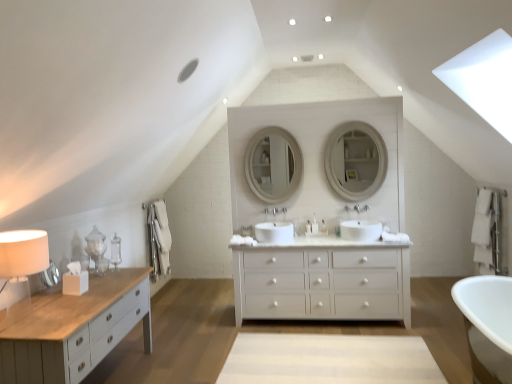
This screenshot has height=384, width=512. Find the location of `white fabric lampshade at left`. white fabric lampshade at left is located at coordinates (21, 265).

This screenshot has height=384, width=512. Identify the location of white glossy faucet at center, the second faucet positioned from the right. click(x=275, y=211).

What do you see at coordinates (275, 211) in the screenshot?
I see `white glossy faucet at center, the first faucet viewed from the left` at bounding box center [275, 211].

Identify the location of white matte chest of drawers at center. The width and height of the screenshot is (512, 384). (322, 283).

The width and height of the screenshot is (512, 384). What are the coordinates of `white glossy sink at center, the second sink in the right-to-left sequence` in the screenshot? It's located at (274, 231).

Can you confirm if white glossy sink at center, the second sink in the right-to-left sequence, is positioned to the right of white glossy faucet at center, the second faucet positioned from the right?

No.

In the scene shown: Who is taller, white glossy sink at center, the second sink in the right-to-left sequence, or white glossy faucet at center, the second faucet positioned from the right?

Answer: white glossy sink at center, the second sink in the right-to-left sequence, is taller.

From the image's perspective, is white glossy sink at center, the second sink in the right-to-left sequence, below white glossy faucet at center, the first faucet viewed from the left?

Yes.

In the scene shown: Would you say white glossy sink at center, the second sink in the right-to-left sequence, is outside white glossy faucet at center, the second faucet positioned from the right?

Indeed, white glossy sink at center, the second sink in the right-to-left sequence, is completely outside white glossy faucet at center, the second faucet positioned from the right.

Between white glossy sink at center, the second sink in the right-to-left sequence, and white fabric lampshade at left, which one has less height?

white glossy sink at center, the second sink in the right-to-left sequence.

Is white fabric lampshade at left surrounded by white glossy sink at center, the second sink in the right-to-left sequence?

No, white glossy sink at center, the second sink in the right-to-left sequence, does not contain white fabric lampshade at left.

How distant is white glossy sink at center, the second sink in the right-to-left sequence, from white fabric lampshade at left?

A distance of 7.99 feet exists between white glossy sink at center, the second sink in the right-to-left sequence, and white fabric lampshade at left.

Which is behind, point (290, 230) or point (10, 269)?

The point (290, 230) is farther from the camera.

In the scene shown: Is white glossy sink at center, which is the second sink in left-to-right order, facing towards white ceramic faucet at center, marked as the first faucet in a right-to-left arrangement?

No, white glossy sink at center, which is the second sink in left-to-right order, is not aimed at white ceramic faucet at center, marked as the first faucet in a right-to-left arrangement.

Are white glossy sink at center, the first sink from the right, and white ceramic faucet at center, which is counted as the 2th faucet, starting from the left, located far from each other?

No, there isn't a large distance between white glossy sink at center, the first sink from the right, and white ceramic faucet at center, which is counted as the 2th faucet, starting from the left.

Who is bigger, white glossy sink at center, the first sink from the right, or white ceramic faucet at center, marked as the first faucet in a right-to-left arrangement?

Bigger between the two is white glossy sink at center, the first sink from the right.

Based on the photo, considering the relative sizes of white glossy sink at center, which is the second sink in left-to-right order, and white ceramic faucet at center, marked as the first faucet in a right-to-left arrangement, in the image provided, is white glossy sink at center, which is the second sink in left-to-right order, taller than white ceramic faucet at center, marked as the first faucet in a right-to-left arrangement,?

Correct, white glossy sink at center, which is the second sink in left-to-right order, is much taller as white ceramic faucet at center, marked as the first faucet in a right-to-left arrangement.

Is white ceramic faucet at center, marked as the first faucet in a right-to-left arrangement, wider than matte white mirror at center, the 2th mirror in the left-to-right sequence?

Yes.

Does white ceramic faucet at center, which is counted as the 2th faucet, starting from the left, have a lesser height compared to matte white mirror at center, placed as the first mirror when sorted from right to left?

Yes, white ceramic faucet at center, which is counted as the 2th faucet, starting from the left, is shorter than matte white mirror at center, placed as the first mirror when sorted from right to left.

Considering the relative positions of white ceramic faucet at center, which is counted as the 2th faucet, starting from the left, and matte white mirror at center, placed as the first mirror when sorted from right to left, in the image provided, is white ceramic faucet at center, which is counted as the 2th faucet, starting from the left, to the left of matte white mirror at center, placed as the first mirror when sorted from right to left, from the viewer's perspective?

Indeed, white ceramic faucet at center, which is counted as the 2th faucet, starting from the left, is positioned on the left side of matte white mirror at center, placed as the first mirror when sorted from right to left.

Measure the distance between white ceramic faucet at center, marked as the first faucet in a right-to-left arrangement, and matte white mirror at center, placed as the first mirror when sorted from right to left.

37.19 inches.

Visually, is white glossy mirror at center, acting as the second mirror starting from the right, positioned to the left or to the right of white ceramic faucet at center, marked as the first faucet in a right-to-left arrangement?

Clearly, white glossy mirror at center, acting as the second mirror starting from the right, is on the left of white ceramic faucet at center, marked as the first faucet in a right-to-left arrangement, in the image.

From a real-world perspective, is white glossy mirror at center, acting as the second mirror starting from the right, physically located above or below white ceramic faucet at center, marked as the first faucet in a right-to-left arrangement?

white glossy mirror at center, acting as the second mirror starting from the right, is situated higher than white ceramic faucet at center, marked as the first faucet in a right-to-left arrangement, in the real world.

Is white glossy mirror at center, acting as the second mirror starting from the right, turned away from white ceramic faucet at center, which is counted as the 2th faucet, starting from the left?

No, white ceramic faucet at center, which is counted as the 2th faucet, starting from the left, is not at the back of white glossy mirror at center, acting as the second mirror starting from the right.

Which of these two, white glossy mirror at center, acting as the second mirror starting from the right, or white ceramic faucet at center, marked as the first faucet in a right-to-left arrangement, is bigger?

Bigger between the two is white glossy mirror at center, acting as the second mirror starting from the right.

What's the angular difference between white glossy faucet at center, the second faucet positioned from the right, and white glossy mirror at center, the first mirror in the left-to-right sequence,'s facing directions?

white glossy faucet at center, the second faucet positioned from the right, and white glossy mirror at center, the first mirror in the left-to-right sequence, are facing 0.309 degrees away from each other.

In terms of width, does white glossy faucet at center, the first faucet viewed from the left, look wider or thinner when compared to white glossy mirror at center, acting as the second mirror starting from the right?

In the image, white glossy faucet at center, the first faucet viewed from the left, appears to be wider than white glossy mirror at center, acting as the second mirror starting from the right.

Which object is positioned more to the left, white glossy faucet at center, the first faucet viewed from the left, or white glossy mirror at center, the first mirror in the left-to-right sequence?

Positioned to the left is white glossy mirror at center, the first mirror in the left-to-right sequence.

From the image's perspective, relative to white glossy mirror at center, the first mirror in the left-to-right sequence, is white glossy faucet at center, the second faucet positioned from the right, above or below?

white glossy faucet at center, the second faucet positioned from the right, is below white glossy mirror at center, the first mirror in the left-to-right sequence.

From a real-world perspective, is white glossy soap dispenser at center, marked as the 1th toiletry in a left-to-right arrangement, on top of white glossy sink at center, the second sink in the right-to-left sequence?

Indeed, from a real-world perspective, white glossy soap dispenser at center, marked as the 1th toiletry in a left-to-right arrangement, stands above white glossy sink at center, the second sink in the right-to-left sequence.

Is white glossy soap dispenser at center, which is counted as the 3th toiletry, starting from the right, aimed at white glossy sink at center, the second sink in the right-to-left sequence?

No, white glossy soap dispenser at center, which is counted as the 3th toiletry, starting from the right, does not turn towards white glossy sink at center, the second sink in the right-to-left sequence.

Considering the sizes of objects white glossy soap dispenser at center, marked as the 1th toiletry in a left-to-right arrangement, and white glossy sink at center, the second sink in the right-to-left sequence, in the image provided, who is shorter, white glossy soap dispenser at center, marked as the 1th toiletry in a left-to-right arrangement, or white glossy sink at center, the second sink in the right-to-left sequence,?

Standing shorter between the two is white glossy sink at center, the second sink in the right-to-left sequence.

Starting from the white glossy sink at center, the 1th sink in the left-to-right sequence, which faucet is the 1st one to the right? Please provide its 2D coordinates.

[(275, 211)]

Which sink is the 2nd one when counting from the back of the white fabric lampshade at left? Please provide its 2D coordinates.

[(274, 231)]

Which object lies nearer to the anchor point white glossy soap dispenser at center, which is counted as the 3th toiletry, starting from the right, white glossy mirror at center, acting as the second mirror starting from the right, or white glossy sink at center, the second sink in the right-to-left sequence?

Among the two, white glossy sink at center, the second sink in the right-to-left sequence, is located nearer to white glossy soap dispenser at center, which is counted as the 3th toiletry, starting from the right.

Which object lies nearer to the anchor point white glossy sink at center, which is the second sink in left-to-right order, white striped rug at center or clear plastic bottle at center, which is the first toiletry in right-to-left order?

The object closer to white glossy sink at center, which is the second sink in left-to-right order, is clear plastic bottle at center, which is the first toiletry in right-to-left order.

When comparing their distances from white matte chest of drawers at center, does white striped rug at center or white glossy faucet at center, the first faucet viewed from the left, seem further?

Among the two, white glossy faucet at center, the first faucet viewed from the left, is located further to white matte chest of drawers at center.

Estimate the real-world distances between objects in this image. Which object is further from white glossy sink at center, the 1th sink in the left-to-right sequence, white glossy mirror at center, the first mirror in the left-to-right sequence, or white ceramic faucet at center, which is counted as the 2th faucet, starting from the left?

white glossy mirror at center, the first mirror in the left-to-right sequence, is positioned further to the anchor white glossy sink at center, the 1th sink in the left-to-right sequence.

When comparing their distances from white fabric lampshade at left, does white glossy sink at center, which is the second sink in left-to-right order, or white glossy faucet at center, the second faucet positioned from the right, seem closer?

Based on the image, white glossy faucet at center, the second faucet positioned from the right, appears to be nearer to white fabric lampshade at left.

In the scene shown: From the image, which object appears to be farther from white glossy sink at center, which is the second sink in left-to-right order, white glossy mirror at center, acting as the second mirror starting from the right, or white glossy faucet at center, the second faucet positioned from the right?

The object further to white glossy sink at center, which is the second sink in left-to-right order, is white glossy mirror at center, acting as the second mirror starting from the right.

Looking at the image, which one is located closer to white matte chest of drawers at center, white glossy mirror at center, acting as the second mirror starting from the right, or white glossy toiletry at center, which is counted as the second toiletry, starting from the left?

Among the two, white glossy toiletry at center, which is counted as the second toiletry, starting from the left, is located nearer to white matte chest of drawers at center.

Based on their spatial positions, is white matte chest of drawers at center or clear plastic bottle at center, which is the first toiletry in right-to-left order, further from white glossy soap dispenser at center, marked as the 1th toiletry in a left-to-right arrangement?

white matte chest of drawers at center lies further to white glossy soap dispenser at center, marked as the 1th toiletry in a left-to-right arrangement, than the other object.

The image size is (512, 384). I want to click on faucet between white glossy sink at center, the 1th sink in the left-to-right sequence, and white ceramic faucet at center, marked as the first faucet in a right-to-left arrangement, from front to back, so click(275, 211).

You are a GUI agent. You are given a task and a screenshot of the screen. Output one action in this format:
    pyautogui.click(x=<x>, y=<y>)
    Task: Click on the faucet positioned between white striped rug at center and white glossy toiletry at center, which is counted as the second toiletry, starting from the left, from near to far
    This screenshot has height=384, width=512.
    Given the screenshot: What is the action you would take?
    pyautogui.click(x=275, y=211)

I want to click on plain between white fabric lampshade at left and white glossy sink at center, the first sink from the right, so click(x=329, y=360).

The height and width of the screenshot is (384, 512). What are the coordinates of `faucet situated between white glossy faucet at center, the second faucet positioned from the right, and white glossy soap dispenser at center, marked as the 1th toiletry in a left-to-right arrangement, from left to right` in the screenshot? It's located at (284, 210).